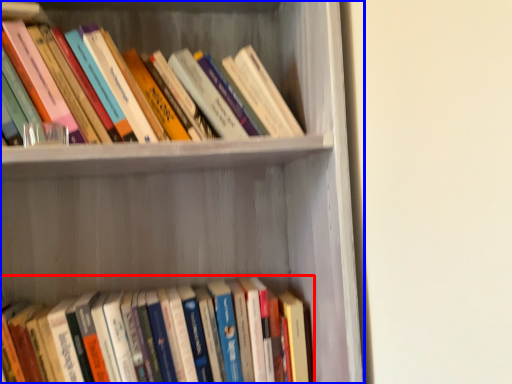
Question: Which of the following is the closest to the observer, book (highlighted by a red box) or shelf (highlighted by a blue box)?

Choices:
 (A) book
 (B) shelf

Answer: (B)